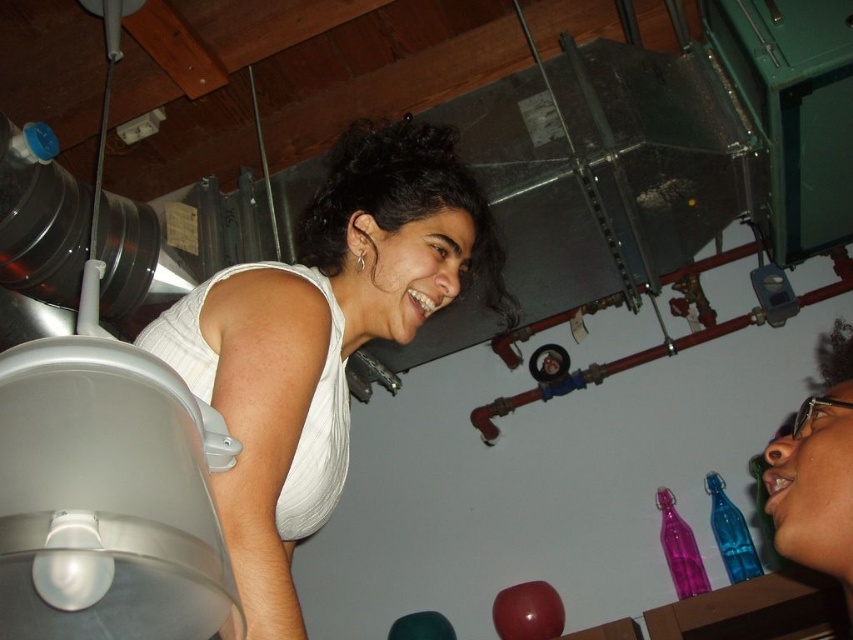
You are a photographer setting up a shoot in this room. You want to place a small lamp between the white matte tank top at upper left and the translucent blue glass bottle at lower right. Based on their positions, where should the lamp be placed?

The lamp should be placed between the white matte tank top at upper left and the translucent blue glass bottle at lower right, since the white matte tank top at upper left is positioned on the left side of the translucent blue glass bottle at lower right.

You are designing a display case for the translucent blue glass bottle at lower right and the white matte tank top at upper left. The case has two shelves with limited width. Based on their sizes, which item should be placed on the shelf with more space?

The white matte tank top at upper left has a larger width than the translucent blue glass bottle at lower right, so it should be placed on the shelf with more space.

You are standing in the workshop and want to hand a tool to the person wearing the white matte tank top at upper left without moving your position. The translucent blue glass bottle at lower right is in your line of sight. Can you reach the person without moving the bottle?

The white matte tank top at upper left is closer to the viewer than the translucent blue glass bottle at lower right, so you can reach the person without moving the bottle because the bottle is behind them.